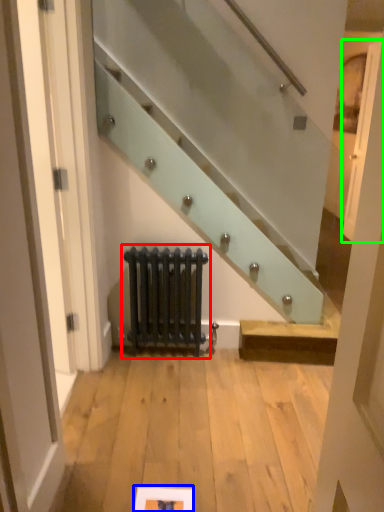
Question: Which object is positioned closest to radiator (highlighted by a red box)? Select from picture frame (highlighted by a blue box) and door (highlighted by a green box).

Choices:
 (A) picture frame
 (B) door

Answer: (A)